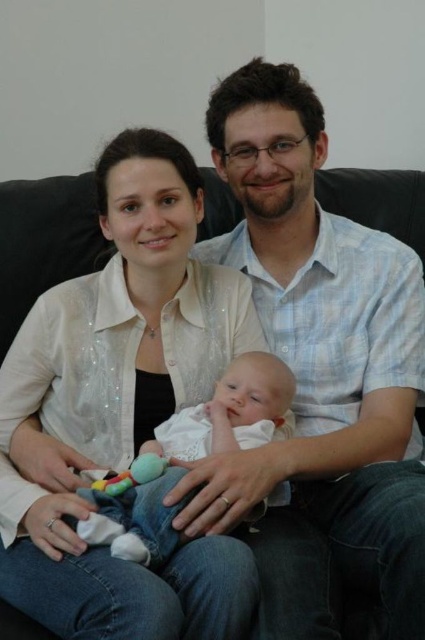
Describe the element at coordinates (187, 458) in the screenshot. I see `white soft fabric baby at center` at that location.

Is white soft fabric baby at center smaller than plush multicolored toy at center?

Incorrect, white soft fabric baby at center is not smaller in size than plush multicolored toy at center.

Does point (238, 380) come in front of point (158, 465)?

That is False.

Locate an element on the screen. This screenshot has height=640, width=425. white soft fabric baby at center is located at coordinates [x=187, y=458].

Which of these two, white glittery blouse at center or white soft fabric baby at center, stands shorter?

With less height is white soft fabric baby at center.

Between white glittery blouse at center and white soft fabric baby at center, which one is positioned higher?

white glittery blouse at center is above.

Does point (54, 352) come in front of point (268, 371)?

Yes, point (54, 352) is closer to viewer.

Locate an element on the screen. This screenshot has height=640, width=425. white glittery blouse at center is located at coordinates (121, 408).

Does point (277, 525) lie behind point (62, 480)?

That is False.

The width and height of the screenshot is (425, 640). Identify the location of blue plaid shirt at center. (323, 346).